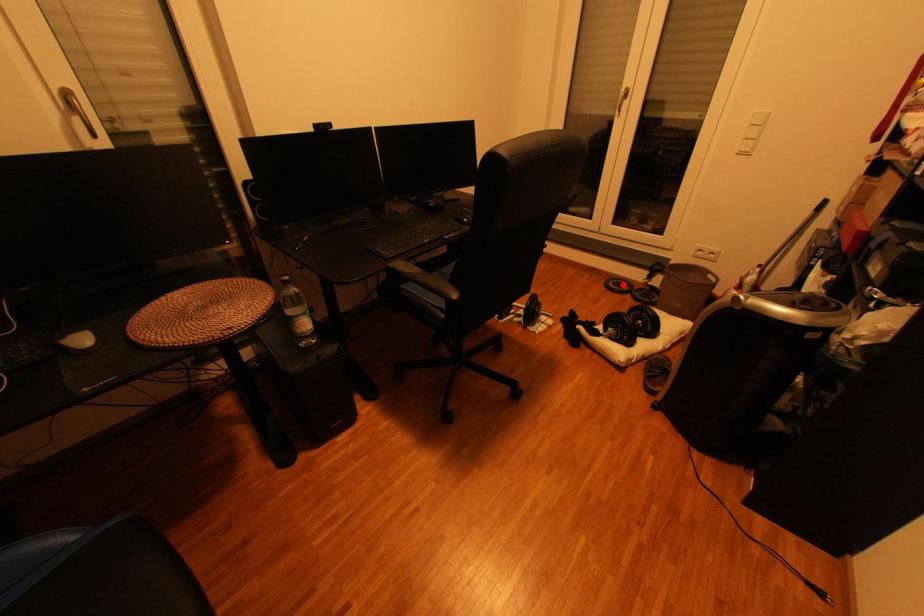
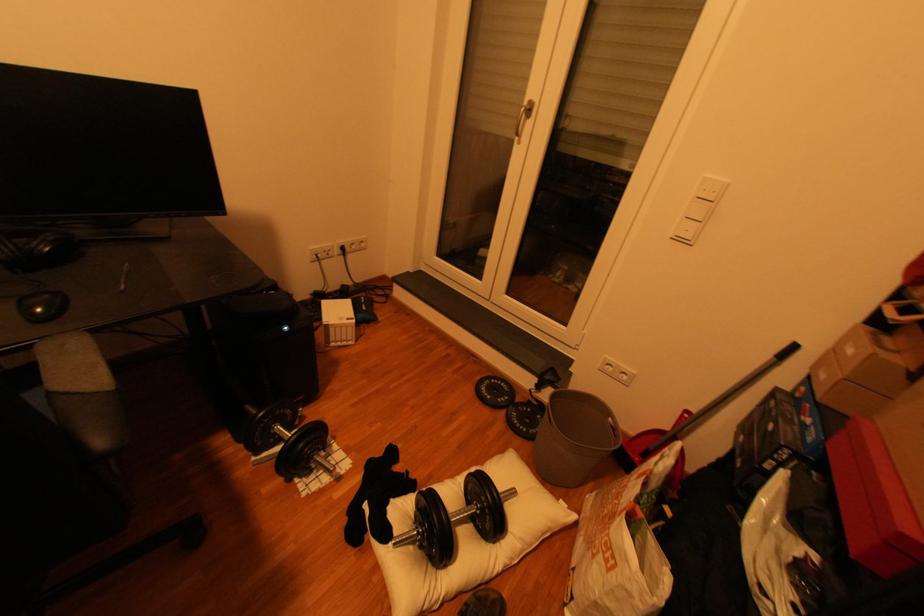
In the second image, find the point that corresponds to the highlighted location in the first image.

(497, 389)